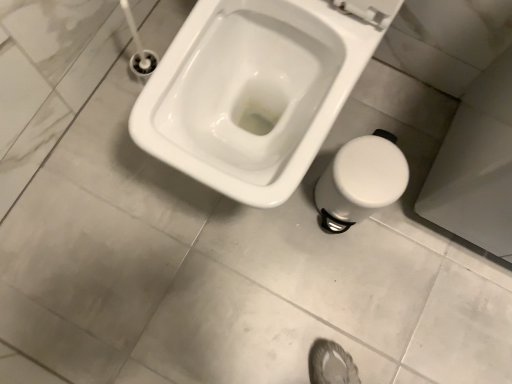
This screenshot has width=512, height=384. I want to click on vacant space to the right of white plastic bidet at lower right, so click(401, 226).